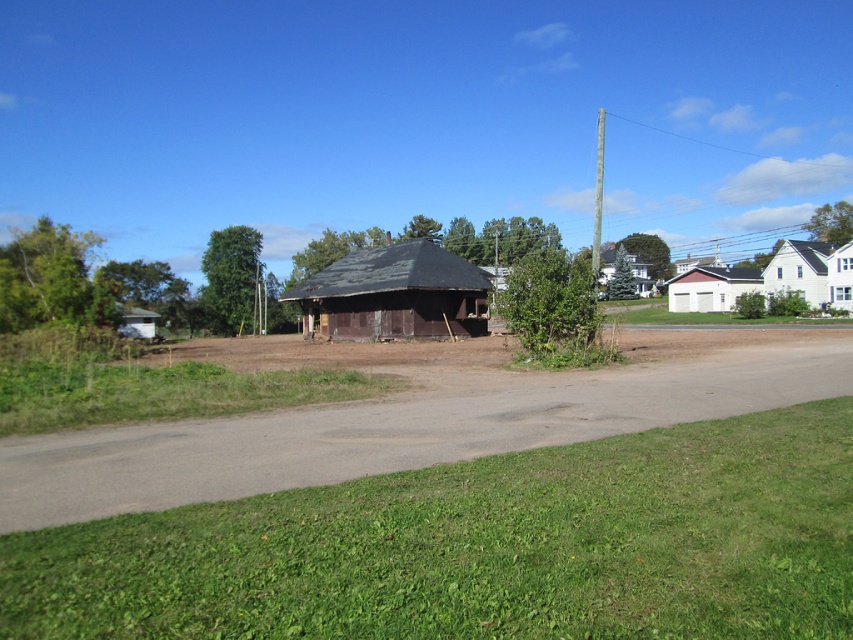
You are standing at the origin point of the image. Which direction should you move to reach the brown dirt track at center?

The brown dirt track at center is located at coordinates point (413, 419), so you should move towards the right and slightly upwards from the origin point to reach it.

You are a landscape architect designing a new garden layout. You need to place a statue that requires 3 meters of space. The statue must be placed between the weathered wood gazebo at center and the white matte house at upper right. Can the space between them accommodate the statue?

The weathered wood gazebo at center has a lesser width compared to white matte house at upper right. However, the description does not provide specific measurements of the distance between them, so it is unclear if the space is sufficient for the statue requiring 3 meters.